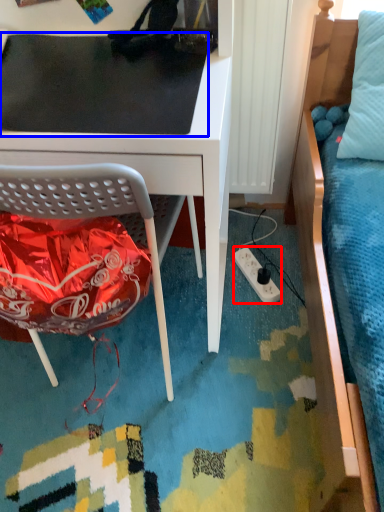
Question: Among these objects, which one is farthest to the camera, power outlet (highlighted by a red box) or table top (highlighted by a blue box)?

Choices:
 (A) power outlet
 (B) table top

Answer: (A)